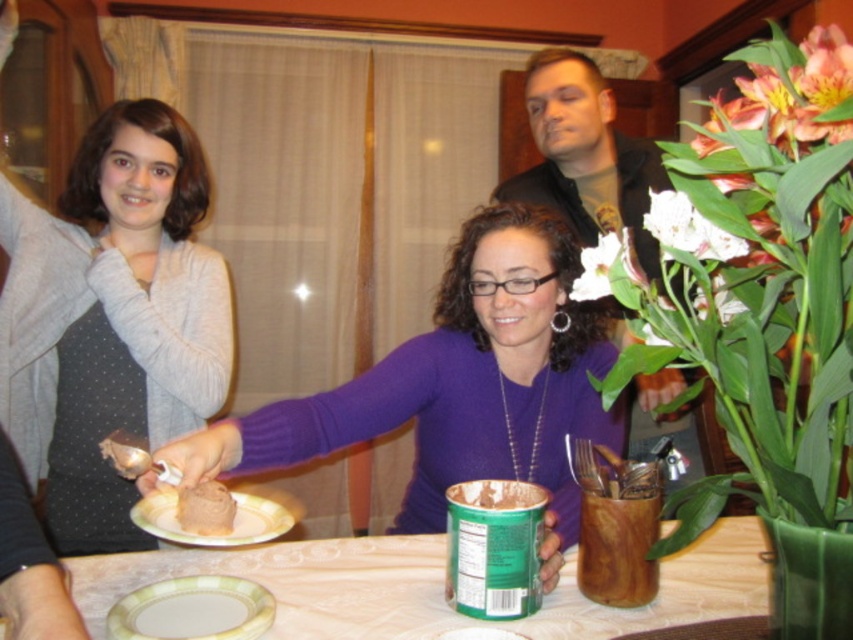
Question: Can you confirm if dark brown leather jacket at upper center is bigger than white matte flower at upper right?

Choices:
 (A) yes
 (B) no

Answer: (A)

Question: Based on their relative distances, which object is farther from the dark brown leather jacket at upper center?

Choices:
 (A) white matte flower at upper right
 (B) purple matte sweater at center
 (C) white glossy plate at center
 (D) chocolate matte cake at center

Answer: (A)

Question: Which of the following is the closest to the observer?

Choices:
 (A) 173,598
 (B) 531,220
 (C) 152,499

Answer: (A)

Question: Is white paper plate at lower left to the left of dark brown leather jacket at upper center from the viewer's perspective?

Choices:
 (A) yes
 (B) no

Answer: (A)

Question: Estimate the real-world distances between objects in this image. Which object is closer to the white matte flower at upper center?

Choices:
 (A) purple matte sweater at center
 (B) dark brown leather jacket at upper center
 (C) white matte flower at upper right

Answer: (C)

Question: Can you confirm if purple matte sweater at center is wider than porcelain plate at lower left?

Choices:
 (A) yes
 (B) no

Answer: (A)